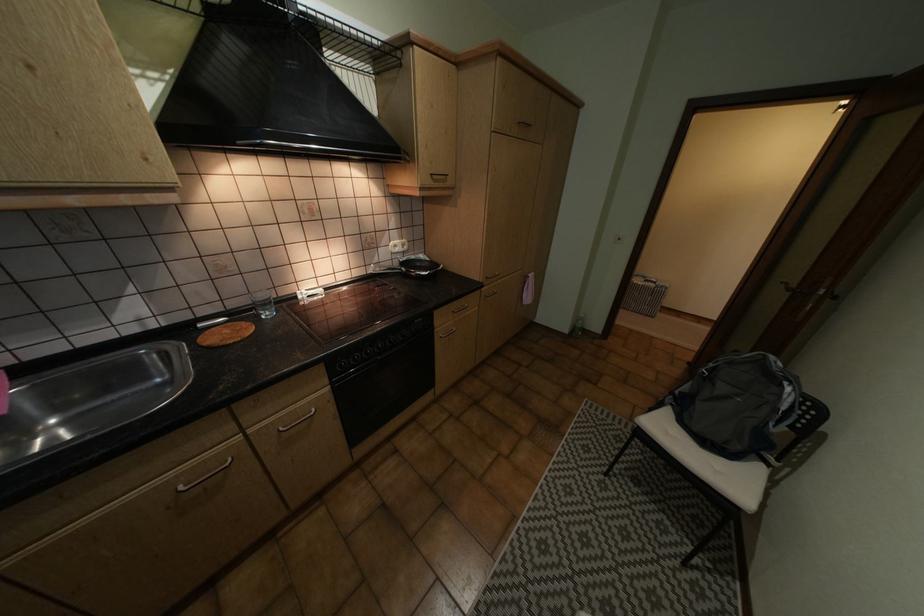
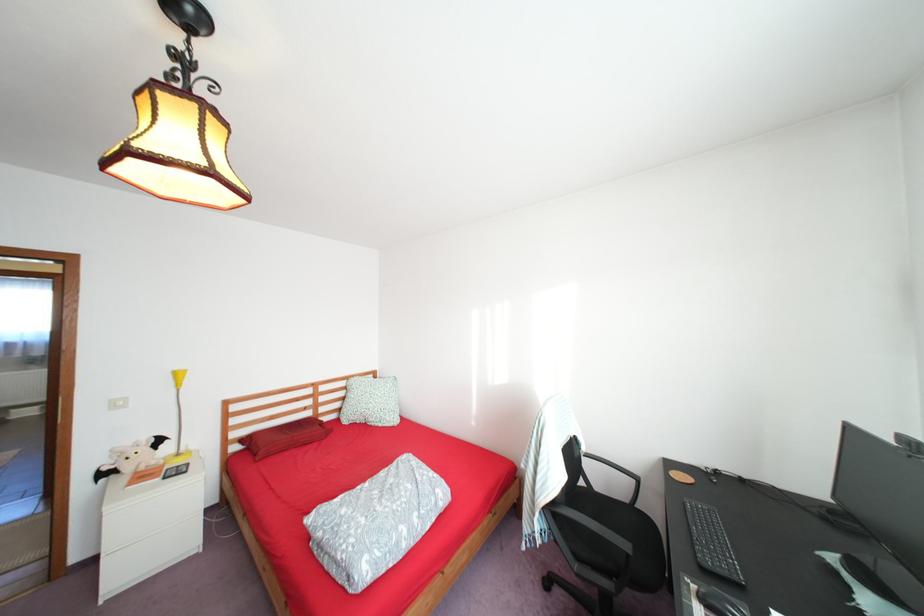
Question: I am providing you with two images of the same scene from different viewpoints. Which of the following objects are not visible in image2?

Choices:
 (A) brown book
 (B) black computer mouse
 (C) red rectangular pillow
 (D) black pan handle

Answer: (D)